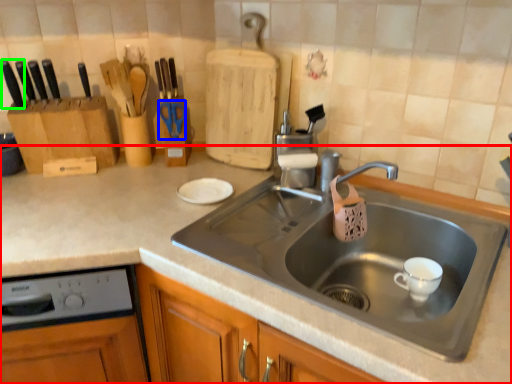
Question: Considering the real-world distances, which object is closest to countertop (highlighted by a red box)? scissors (highlighted by a blue box) or knife (highlighted by a green box).

Choices:
 (A) scissors
 (B) knife

Answer: (A)